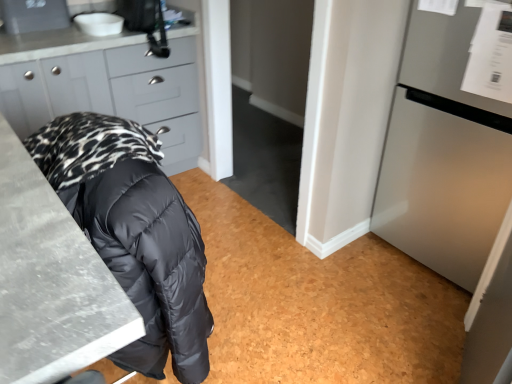
Question: Does matte gray cabinets at upper left have a larger size compared to marble gray countertop at lower left?

Choices:
 (A) no
 (B) yes

Answer: (B)

Question: Does matte gray cabinets at upper left have a greater width compared to marble gray countertop at lower left?

Choices:
 (A) yes
 (B) no

Answer: (A)

Question: Does matte gray cabinets at upper left lie behind marble gray countertop at lower left?

Choices:
 (A) no
 (B) yes

Answer: (B)

Question: From a real-world perspective, is matte gray cabinets at upper left over marble gray countertop at lower left?

Choices:
 (A) no
 (B) yes

Answer: (A)

Question: Is matte gray cabinets at upper left in front of marble gray countertop at lower left?

Choices:
 (A) no
 (B) yes

Answer: (A)

Question: In the image, is matte gray cabinets at upper left positioned in front of or behind satin silver refrigerator at right?

Choices:
 (A) front
 (B) behind

Answer: (B)

Question: Is matte gray cabinets at upper left inside the boundaries of satin silver refrigerator at right, or outside?

Choices:
 (A) outside
 (B) inside

Answer: (A)

Question: Is matte gray cabinets at upper left wider or thinner than satin silver refrigerator at right?

Choices:
 (A) thin
 (B) wide

Answer: (B)

Question: In terms of height, does matte gray cabinets at upper left look taller or shorter compared to satin silver refrigerator at right?

Choices:
 (A) short
 (B) tall

Answer: (A)

Question: Is white glossy sink at upper left to the left or to the right of marble gray countertop at lower left in the image?

Choices:
 (A) left
 (B) right

Answer: (A)

Question: Looking at the image, does white glossy sink at upper left seem bigger or smaller compared to marble gray countertop at lower left?

Choices:
 (A) big
 (B) small

Answer: (B)

Question: Considering the positions of white glossy sink at upper left and marble gray countertop at lower left in the image, is white glossy sink at upper left taller or shorter than marble gray countertop at lower left?

Choices:
 (A) short
 (B) tall

Answer: (A)

Question: From the image's perspective, is white glossy sink at upper left positioned above or below marble gray countertop at lower left?

Choices:
 (A) below
 (B) above

Answer: (B)

Question: Is point (52, 377) positioned closer to the camera than point (114, 21)?

Choices:
 (A) closer
 (B) farther

Answer: (A)

Question: In the image, is marble gray countertop at lower left on the left side or the right side of white glossy sink at upper left?

Choices:
 (A) right
 (B) left

Answer: (A)